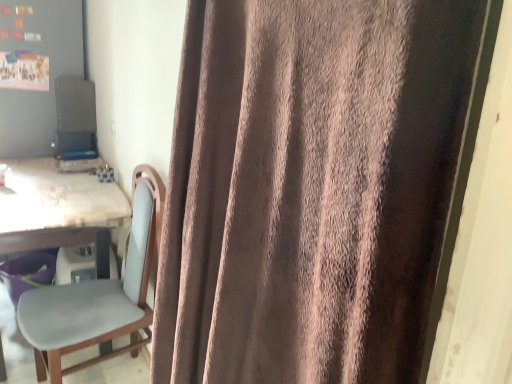
This screenshot has width=512, height=384. Describe the element at coordinates (49, 70) in the screenshot. I see `matte gray bulletin board at upper left` at that location.

This screenshot has width=512, height=384. What do you see at coordinates (56, 208) in the screenshot?
I see `wooden table at left` at bounding box center [56, 208].

Locate an element on the screen. wooden table at left is located at coordinates (56, 208).

Locate an element on the screen. The height and width of the screenshot is (384, 512). matte gray bulletin board at upper left is located at coordinates (49, 70).

Who is bigger, wooden table at left or brown velvety curtain at center?

wooden table at left.

Is the depth of wooden table at left less than that of brown velvety curtain at center?

That is False.

In the scene shown: Is wooden table at left at the left side of brown velvety curtain at center?

Indeed, wooden table at left is positioned on the left side of brown velvety curtain at center.

Is brown velvety curtain at center closer to camera compared to matte gray bulletin board at upper left?

Yes, it is.

Between point (231, 198) and point (29, 8), which one is positioned behind?

The point (29, 8) is behind.

Measure the distance between brown velvety curtain at center and matte gray bulletin board at upper left.

They are 7.75 feet apart.

Could you tell me if brown velvety curtain at center is turned towards matte gray bulletin board at upper left?

No, brown velvety curtain at center does not turn towards matte gray bulletin board at upper left.

Is matte gray bulletin board at upper left taller than brown velvety curtain at center?

No, matte gray bulletin board at upper left is not taller than brown velvety curtain at center.

Where is `bulletin board above the brown velvety curtain at center (from the image's perspective)`? bulletin board above the brown velvety curtain at center (from the image's perspective) is located at coordinates (49, 70).

From the image's perspective, is matte gray bulletin board at upper left above or below brown velvety curtain at center?

From the image's perspective, matte gray bulletin board at upper left appears above brown velvety curtain at center.

What's the angular difference between wooden table at left and matte gray bulletin board at upper left's facing directions?

The angular difference between wooden table at left and matte gray bulletin board at upper left is 0.723 degrees.

Can you confirm if wooden table at left is positioned to the right of matte gray bulletin board at upper left?

Yes.

Which object is more forward, wooden table at left or matte gray bulletin board at upper left?

Positioned in front is wooden table at left.

Considering the positions of objects brown velvety curtain at center and wooden table at left in the image provided, who is behind, brown velvety curtain at center or wooden table at left?

wooden table at left is more distant.

From the image's perspective, would you say brown velvety curtain at center is shown under wooden table at left?

Yes, from the image's perspective, brown velvety curtain at center is beneath wooden table at left.

Can you tell me how much brown velvety curtain at center and wooden table at left differ in facing direction?

brown velvety curtain at center and wooden table at left are facing 3.44 degrees away from each other.

How distant is brown velvety curtain at center from wooden table at left?

brown velvety curtain at center is 1.20 meters from wooden table at left.

Is the surface of matte gray bulletin board at upper left in direct contact with wooden table at left?

No, matte gray bulletin board at upper left is not next to wooden table at left.

Considering their positions, is matte gray bulletin board at upper left located in front of or behind wooden table at left?

matte gray bulletin board at upper left is positioned farther from the viewer than wooden table at left.

This screenshot has width=512, height=384. Find the location of `table below the matte gray bulletin board at upper left (from the image's perspective)`. table below the matte gray bulletin board at upper left (from the image's perspective) is located at coordinates (56, 208).

Considering the sizes of matte gray bulletin board at upper left and wooden table at left in the image, is matte gray bulletin board at upper left taller or shorter than wooden table at left?

matte gray bulletin board at upper left is taller than wooden table at left.

I want to click on table that appears above the brown velvety curtain at center (from the image's perspective), so click(56, 208).

Locate an element on the screen. This screenshot has height=384, width=512. curtain below the matte gray bulletin board at upper left (from a real-world perspective) is located at coordinates [x=316, y=187].

Looking at the image, which one is located closer to wooden table at left, matte gray bulletin board at upper left or brown velvety curtain at center?

matte gray bulletin board at upper left lies closer to wooden table at left than the other object.

From the image, which object appears to be farther from matte gray bulletin board at upper left, brown velvety curtain at center or wooden table at left?

brown velvety curtain at center.

When comparing their distances from matte gray bulletin board at upper left, does wooden table at left or brown velvety curtain at center seem closer?

Based on the image, wooden table at left appears to be nearer to matte gray bulletin board at upper left.

Considering their positions, is wooden table at left positioned further to brown velvety curtain at center than matte gray bulletin board at upper left?

Among the two, matte gray bulletin board at upper left is located further to brown velvety curtain at center.

Which object lies nearer to the anchor point wooden table at left, brown velvety curtain at center or matte gray bulletin board at upper left?

Based on the image, matte gray bulletin board at upper left appears to be nearer to wooden table at left.

Estimate the real-world distances between objects in this image. Which object is closer to brown velvety curtain at center, matte gray bulletin board at upper left or wooden table at left?

Based on the image, wooden table at left appears to be nearer to brown velvety curtain at center.

Where is `table located between brown velvety curtain at center and matte gray bulletin board at upper left in the depth direction`? The height and width of the screenshot is (384, 512). table located between brown velvety curtain at center and matte gray bulletin board at upper left in the depth direction is located at coordinates (56, 208).